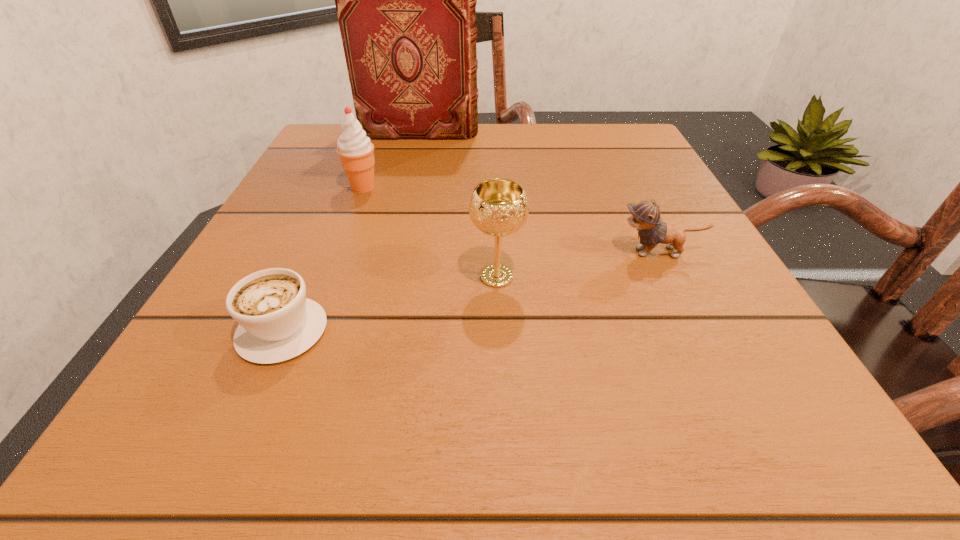
Point out which object is positioned as the fourth nearest to the icecream. Please provide its 2D coordinates. Your answer should be formatted as a tuple, i.e. [(x, y)], where the tuple contains the x and y coordinates of a point satisfying the conditions above.

[(645, 216)]

Identify which object is the fourth nearest to the nearest object. Please provide its 2D coordinates. Your answer should be formatted as a tuple, i.e. [(x, y)], where the tuple contains the x and y coordinates of a point satisfying the conditions above.

[(406, 0)]

Where is `vacant point that satisfies the following two spatial constraints: 1. to the right of the chalice's handle; 2. on the left side of the cappuccino`? vacant point that satisfies the following two spatial constraints: 1. to the right of the chalice's handle; 2. on the left side of the cappuccino is located at coordinates (306, 276).

Where is `free space in the image that satisfies the following two spatial constraints: 1. on the spine side of the chalice; 2. on the right side of the hardback book`? free space in the image that satisfies the following two spatial constraints: 1. on the spine side of the chalice; 2. on the right side of the hardback book is located at coordinates (387, 276).